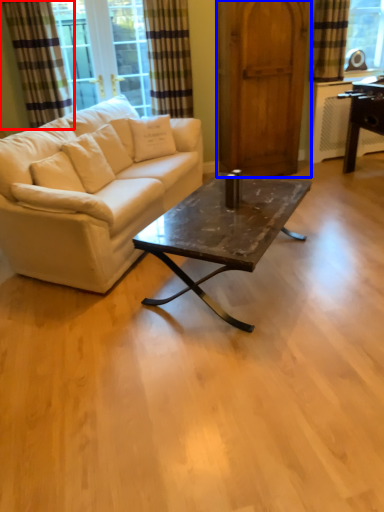
Question: Which object appears farthest to the camera in this image, curtain (highlighted by a red box) or barn door (highlighted by a blue box)?

Choices:
 (A) curtain
 (B) barn door

Answer: (B)